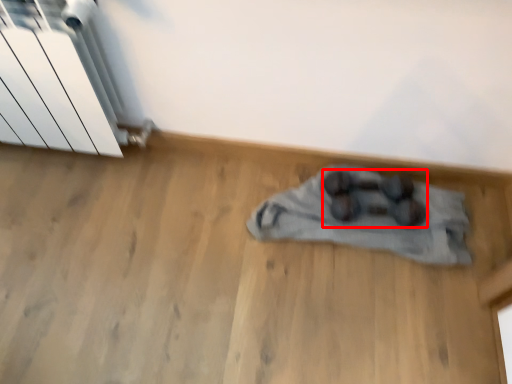
Question: From the image's perspective, where is footwear (annotated by the red box) located relative to radiator?

Choices:
 (A) above
 (B) below

Answer: (B)